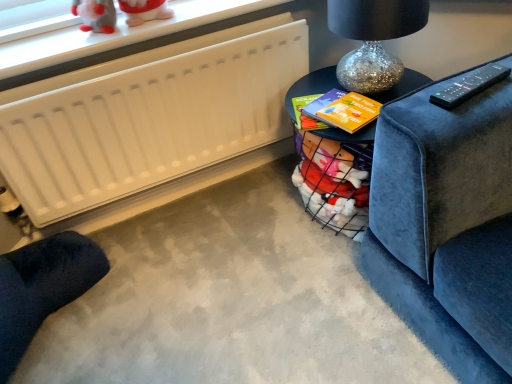
At what (x,y) coordinates should I click in order to perform the action: click on vacant area that lies between black glossy table at center, the first table in the front-to-back sequence, and dark blue fabric footrest at lower left. Please return your answer as a coordinate pair (x, y). This screenshot has height=384, width=512. Looking at the image, I should click on (203, 276).